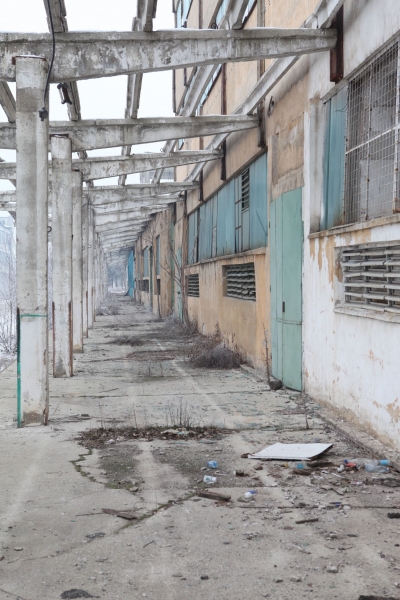
You are a GUI agent. You are given a task and a screenshot of the screen. Output one action in this format:
    pyautogui.click(x=<x>, y=<y>)
    Task: Click on the white board on the ground
    
    Given the screenshot: What is the action you would take?
    [x=302, y=455]